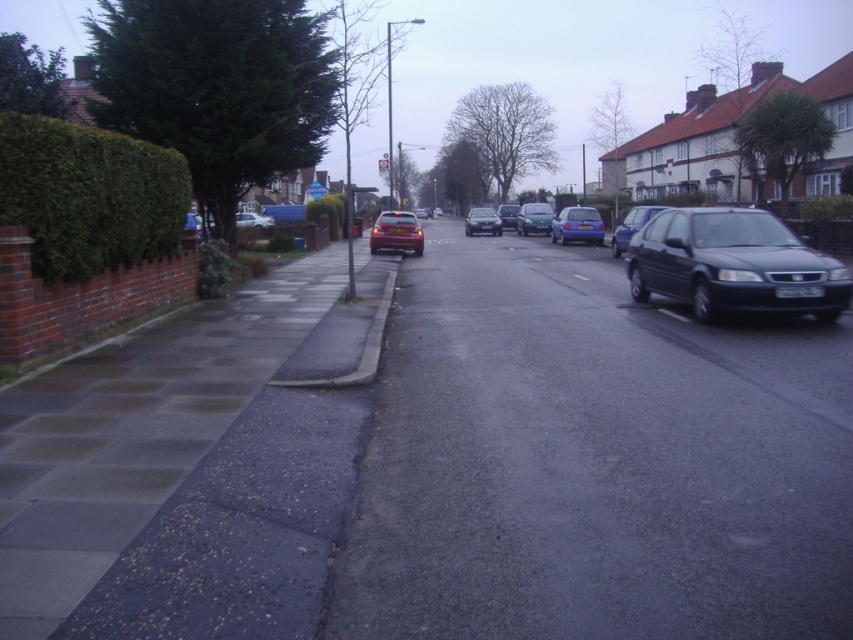
You are standing on the sidewalk and want to take a photo of both point (389, 296) and point (480, 227) in the scene. Since you can only focus on one point at a time, which point should you focus on to ensure the other is still in the frame?

You should focus on point (389, 296) because it is closer to the camera than point (480, 227). By focusing on the closer point, the depth of field may still keep the farther point in acceptable focus, especially in the subdued lighting of the scene.

In the scene shown: You are a delivery person with a bike that has a 0.8 meter wheelbase. You need to navigate around the gray concrete curb at lower center and the shiny silver sedan at center. Which object requires more caution due to its width when maneuvering your bike?

The gray concrete curb at lower center has a lesser width compared to the shiny silver sedan at center. Since the curb is narrower, it might be harder to maneuver around without hitting the bike, so the gray concrete curb at lower center requires more caution due to its narrower width.